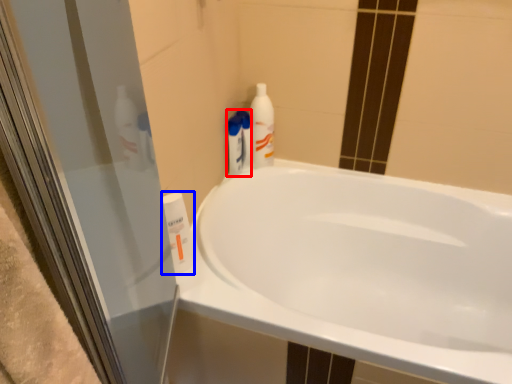
Question: Which object appears farthest to the camera in this image, cleaning product (highlighted by a red box) or cleaning product (highlighted by a blue box)?

Choices:
 (A) cleaning product
 (B) cleaning product

Answer: (A)